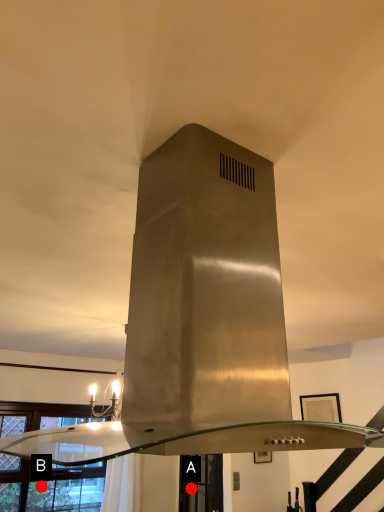
Question: Two points are circled on the image, labeled by A and B beside each circle. Which point appears farthest from the camera in this image?

Choices:
 (A) A is further
 (B) B is further

Answer: (A)